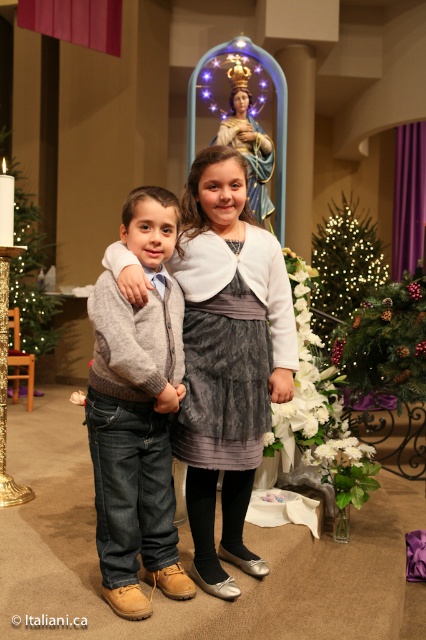
You are a photographer setting up for a Christmas event. You need to position a camera so that both the matte gray dress at center and the illuminated green christmas tree at center are in frame. Based on their positions, which object should appear higher in the photo?

The illuminated green christmas tree at center is positioned above the matte gray dress at center, so it will appear higher in the photo.

You are a photographer trying to capture the children in the scene. The point at coordinates point (227, 356) is on the matte gray dress at center. Which child is closer to the camera?

The point at coordinates point (227, 356) is on the matte gray dress at center, so the girl in the dark lace skirt and white cardigan is closer to the camera.

You are standing in the center of the room and want to take a photo of the illuminated green christmas tree at center. In which direction should you move to get a better view of it?

The illuminated green christmas tree at center is located at point 0.416 on the x axis and 0.810 on the y axis, so you should move towards the lower right direction to get a better view of it.